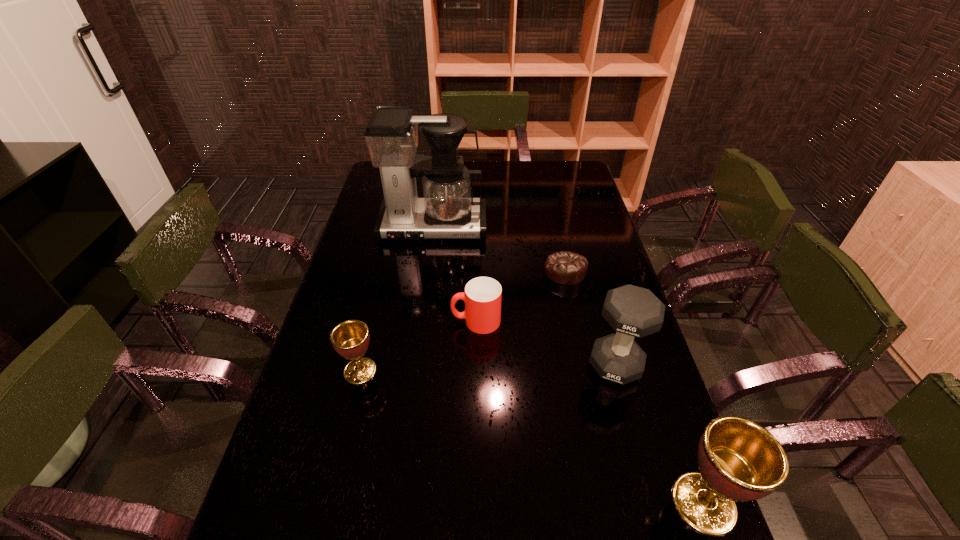
I want to click on coffee maker present at the left edge, so click(x=447, y=210).

You are a GUI agent. You are given a task and a screenshot of the screen. Output one action in this format:
    pyautogui.click(x=<x>, y=<y>)
    Task: Click on the chalice that is at the right edge
    The image size is (960, 540).
    Given the screenshot: What is the action you would take?
    pyautogui.click(x=739, y=460)

I want to click on beanbag situated at the right edge, so click(567, 268).

Find the location of a particular element. dumbbell that is positioned at the right edge is located at coordinates (632, 311).

Locate an element on the screen. object located in the near right corner section of the desktop is located at coordinates (739, 460).

In the image, there is a desktop. Where is `vacant space at the far edge`? This screenshot has width=960, height=540. vacant space at the far edge is located at coordinates (531, 164).

You are a GUI agent. You are given a task and a screenshot of the screen. Output one action in this format:
    pyautogui.click(x=<x>, y=<y>)
    Task: Click on the vacant space at the near edge of the desktop
    
    Given the screenshot: What is the action you would take?
    pyautogui.click(x=563, y=499)

In order to click on free location at the left edge in this screenshot , I will do `click(374, 195)`.

At what (x,y) coordinates should I click in order to perform the action: click on free space at the right edge. Please return your answer as a coordinate pair (x, y). Looking at the image, I should click on (642, 337).

At what (x,y) coordinates should I click in order to perform the action: click on blank region between the farther chalice and the beanbag. Please return your answer as a coordinate pair (x, y). Looking at the image, I should click on (463, 321).